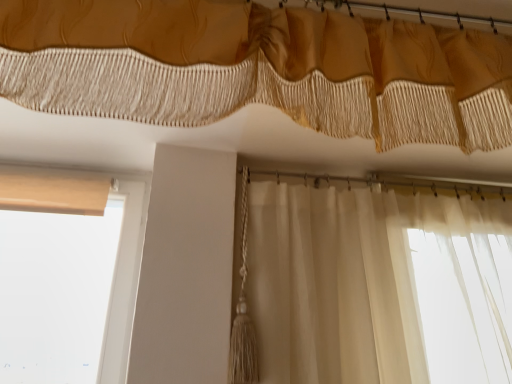
Find the location of a particular element. This screenshot has width=512, height=384. gold satin valance at upper center is located at coordinates (258, 69).

The image size is (512, 384). What do you see at coordinates (258, 69) in the screenshot?
I see `gold satin valance at upper center` at bounding box center [258, 69].

Locate an element on the screen. The height and width of the screenshot is (384, 512). gold satin valance at upper center is located at coordinates (258, 69).